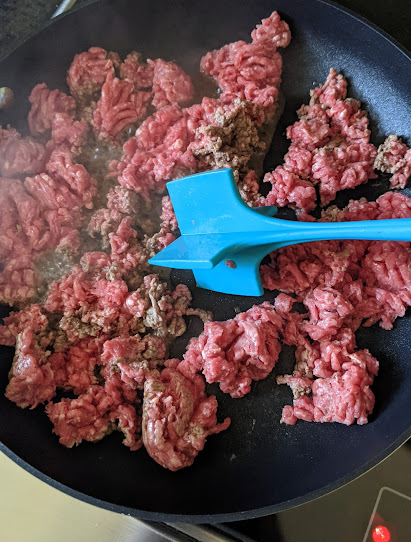
Locate an element on the screen. The height and width of the screenshot is (542, 411). black nonstick pan is located at coordinates (29, 440), (336, 453), (169, 490), (272, 415), (392, 354), (188, 19), (64, 42), (347, 42), (388, 94).